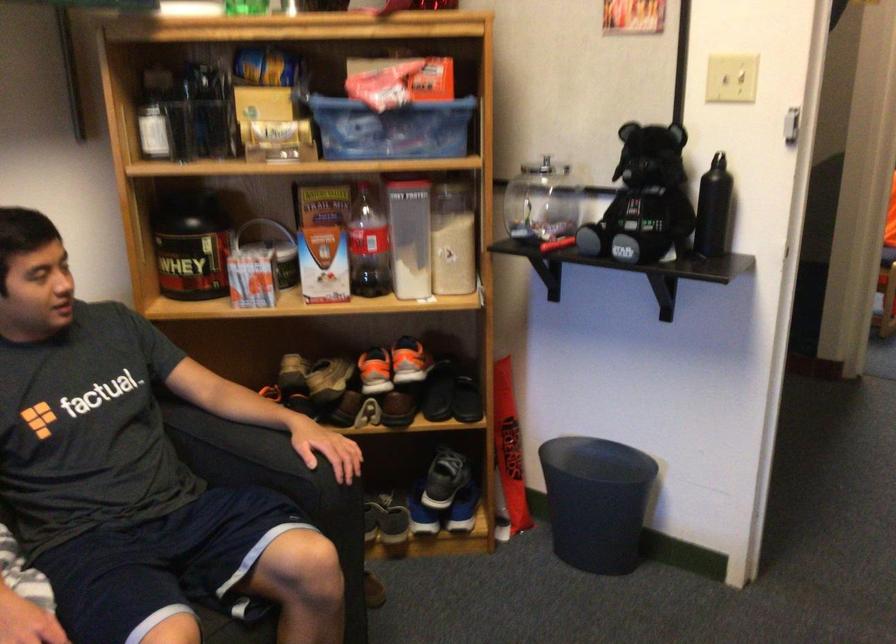
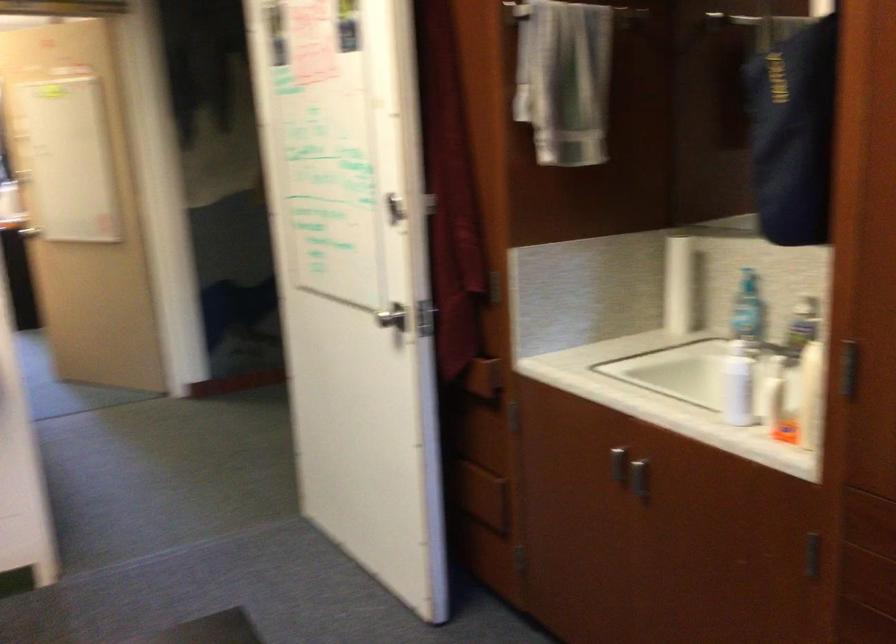
Question: Based on the continuous images, in which direction is the camera rotating? Reply with the corresponding letter.

Choices:
 (A) Left
 (B) Right
 (C) Up
 (D) Down

Answer: (B)